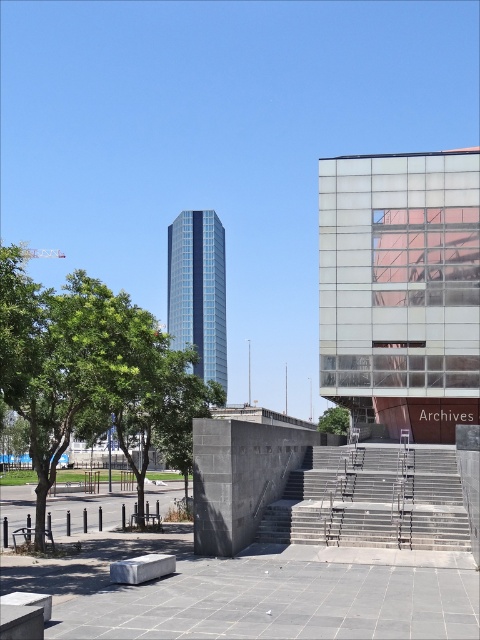
Question: Is glassy reflective building at upper right wider than concrete stairs at center?

Choices:
 (A) no
 (B) yes

Answer: (B)

Question: Which object is positioned farthest from the glassy reflective building at upper right?

Choices:
 (A) glassy blue skyscraper at center
 (B) green leafy tree at left

Answer: (A)

Question: Which object is farther from the camera taking this photo?

Choices:
 (A) glassy blue skyscraper at center
 (B) glassy reflective building at upper right
 (C) concrete stairs at center

Answer: (B)

Question: Considering the relative positions of glassy reflective building at upper right and green leafy tree at left in the image provided, where is glassy reflective building at upper right located with respect to green leafy tree at left?

Choices:
 (A) above
 (B) below

Answer: (A)

Question: In this image, where is glassy reflective building at upper right located relative to green leafy tree at left?

Choices:
 (A) above
 (B) below

Answer: (A)

Question: Which point appears farthest from the camera in this image?

Choices:
 (A) pyautogui.click(x=194, y=324)
 (B) pyautogui.click(x=328, y=408)

Answer: (A)